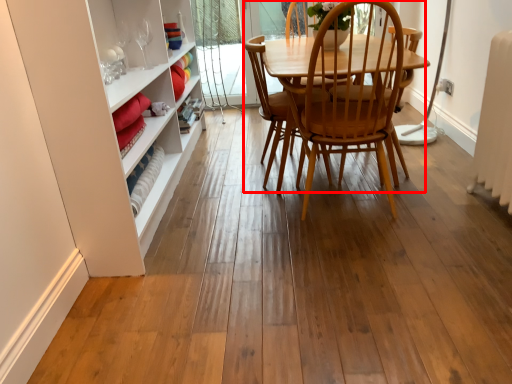
Question: From the image's perspective, considering the relative positions of chair (annotated by the red box) and armchair in the image provided, where is chair (annotated by the red box) located with respect to the staircase?

Choices:
 (A) above
 (B) below

Answer: (B)